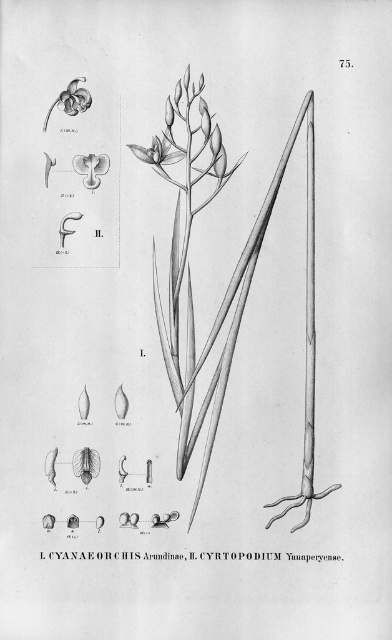
Question: Does matte white flower at upper left have a larger size compared to matte white orchid at upper left?

Choices:
 (A) yes
 (B) no

Answer: (B)

Question: Which point is closer to the camera?

Choices:
 (A) (157, 148)
 (B) (61, 93)

Answer: (B)

Question: Which object is the farthest from the matte white flower at upper left?

Choices:
 (A) matte white orchid at upper left
 (B) matte white flower at upper center

Answer: (A)

Question: Can you confirm if matte white flower at upper left is positioned above matte white orchid at upper left?

Choices:
 (A) yes
 (B) no

Answer: (B)

Question: Which point is closer to the camera?

Choices:
 (A) matte white orchid at upper left
 (B) matte white flower at upper left
 (C) matte white flower at upper center

Answer: (A)

Question: From the image, what is the correct spatial relationship of matte white flower at upper center in relation to matte white flower at upper left?

Choices:
 (A) above
 (B) below

Answer: (A)